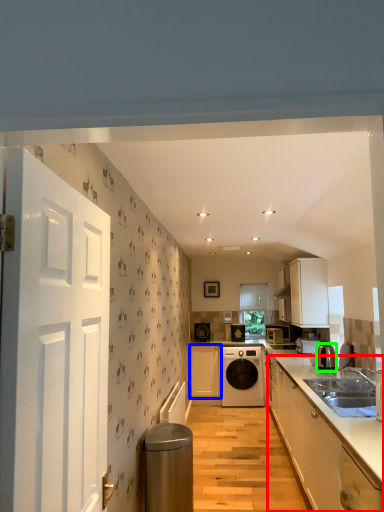
Question: Which object is the farthest from cabinetry (highlighted by a red box)? Choose among these: cabinetry (highlighted by a blue box) or kitchen appliance (highlighted by a green box).

Choices:
 (A) cabinetry
 (B) kitchen appliance

Answer: (A)